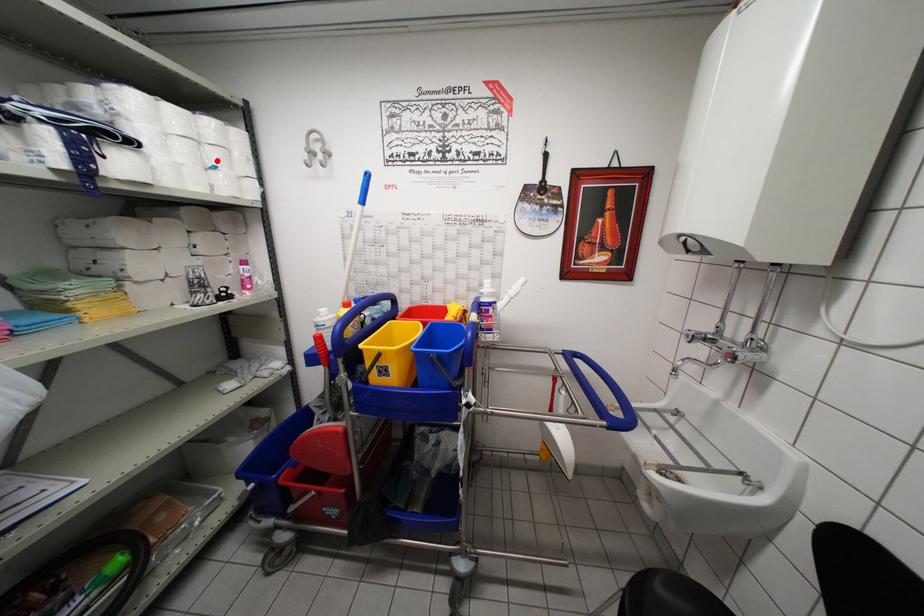
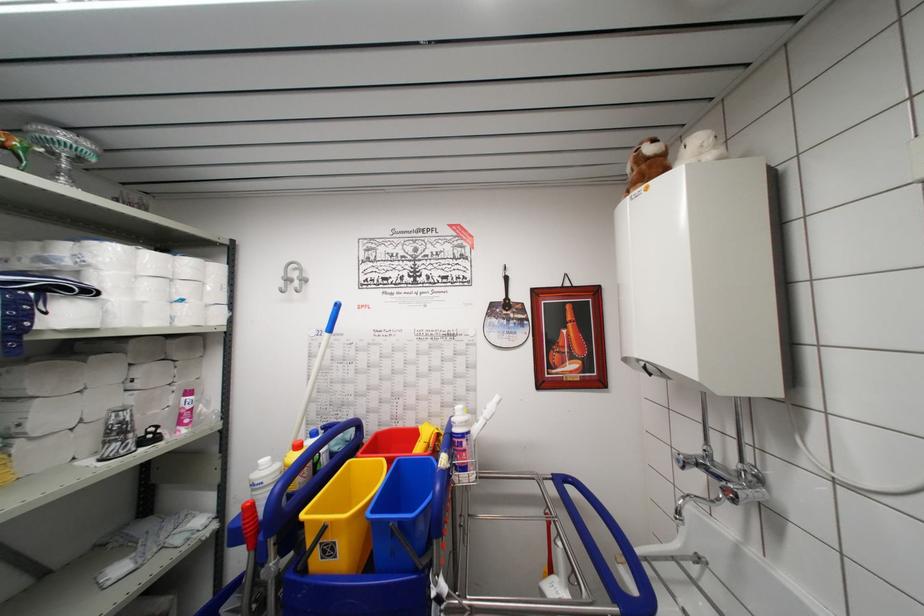
Find the pixel in the second image that matches the highlighted location in the first image.

(188, 294)